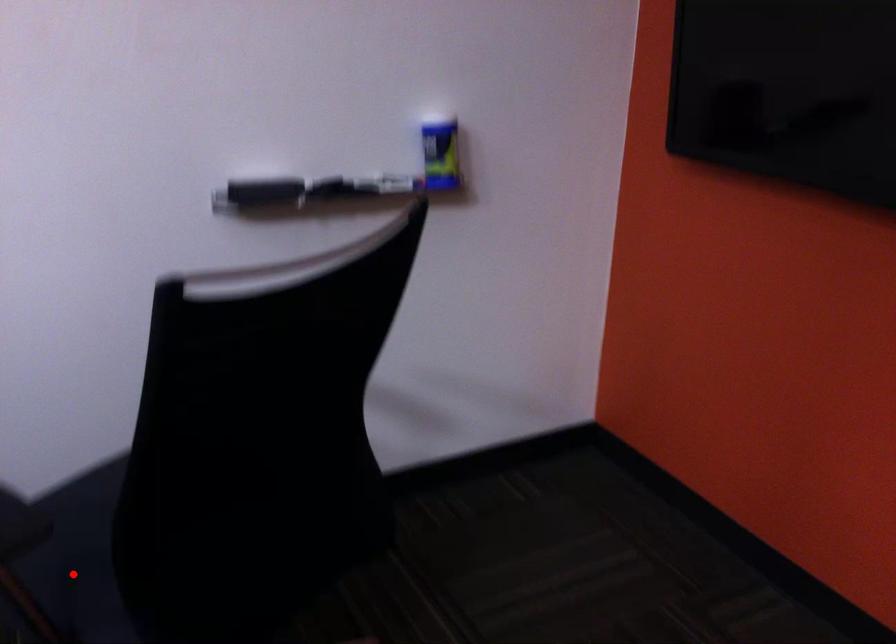
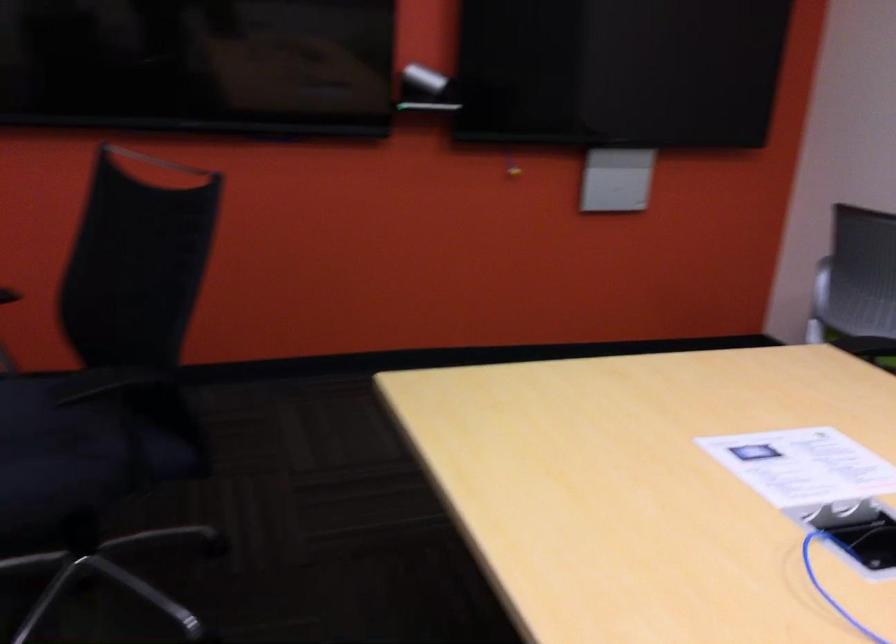
Question: I am providing you with two images of the same scene from different viewpoints. Image1 has a red point marked. In image2, the corresponding 3D location appears at what relative position? Reply with the corresponding letter.

Choices:
 (A) Closer
 (B) Farther

Answer: (B)